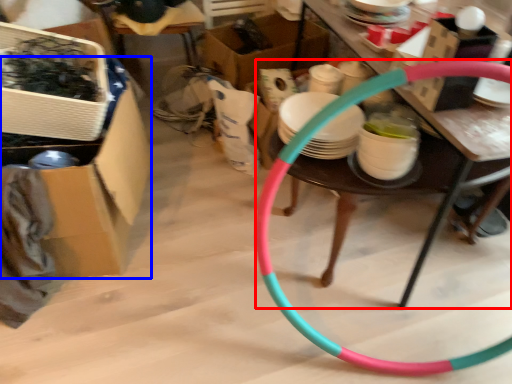
Question: Which point is closer to the camera, table (highlighted by a red box) or box (highlighted by a blue box)?

Choices:
 (A) table
 (B) box

Answer: (A)